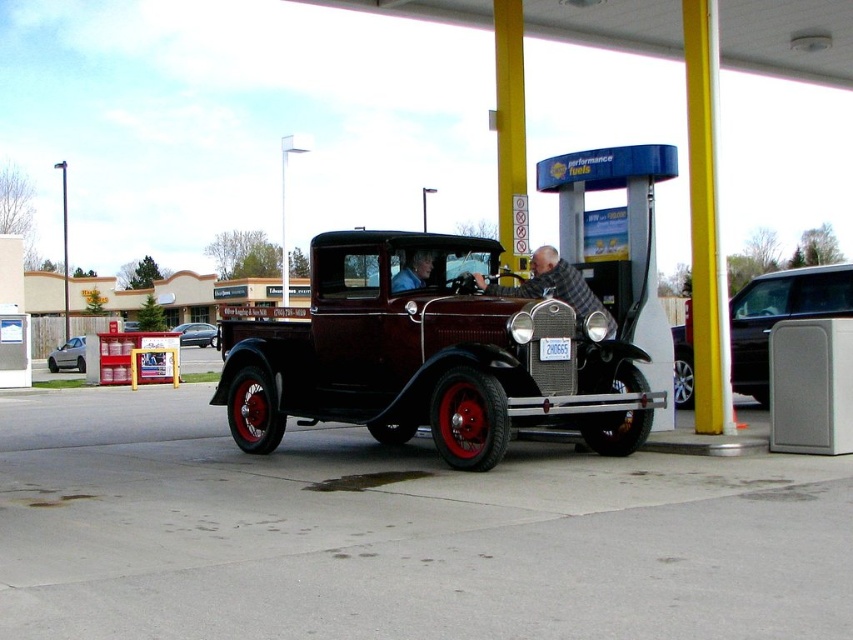
Question: Which point is farther to the camera?

Choices:
 (A) silver metallic hatchback at left
 (B) matte black shirt at center
 (C) shiny silver sedan at center
 (D) metallic silver van at right

Answer: (A)

Question: Which of the following is the closest to the observer?

Choices:
 (A) (523, 412)
 (B) (604, 308)

Answer: (A)

Question: Where is metallic silver van at right located in relation to silver metallic hatchback at left in the image?

Choices:
 (A) below
 (B) above

Answer: (B)

Question: Based on their relative distances, which object is nearer to the metallic silver van at right?

Choices:
 (A) shiny maroon pickup truck at center
 (B) plaid wool sweater at center

Answer: (B)

Question: Can you confirm if matte black shirt at center is smaller than silver metallic hatchback at left?

Choices:
 (A) yes
 (B) no

Answer: (A)

Question: Can you confirm if matte black shirt at center is wider than shiny silver sedan at center?

Choices:
 (A) yes
 (B) no

Answer: (B)